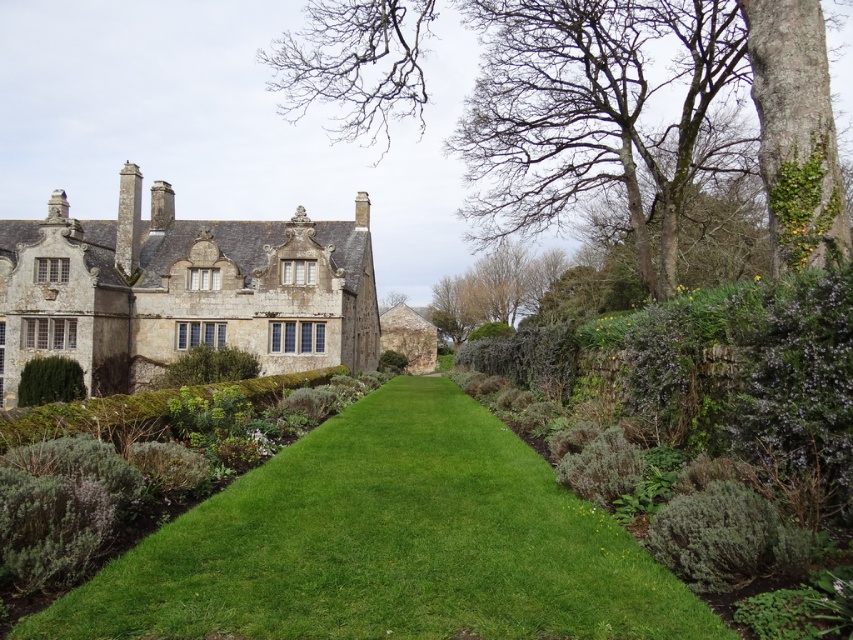
Question: Which of the following is the farthest from the observer?

Choices:
 (A) green leafy tree at center
 (B) bare wood tree at upper center

Answer: (A)

Question: Among these objects, which one is nearest to the camera?

Choices:
 (A) green leafy hedge at center
 (B) green leafy hedge at left
 (C) green grass at center

Answer: (C)

Question: Is green grass at center below green leafy hedge at center?

Choices:
 (A) yes
 (B) no

Answer: (A)

Question: Which of these objects is positioned farthest from the bare wood tree at upper center?

Choices:
 (A) green grass at center
 (B) green leafy hedge at center
 (C) green leafy hedge at left
 (D) green leafy tree at center

Answer: (C)

Question: Is green leafy hedge at center positioned behind green leafy hedge at left?

Choices:
 (A) no
 (B) yes

Answer: (B)

Question: Can you confirm if bare wood tree at upper center is positioned to the right of green leafy hedge at center?

Choices:
 (A) no
 (B) yes

Answer: (B)